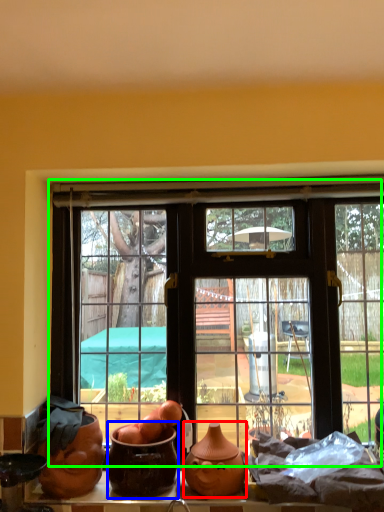
Question: Which object is positioned closest to pottery (highlighted by a red box)? Select from pottery (highlighted by a blue box) and window (highlighted by a green box).

Choices:
 (A) pottery
 (B) window

Answer: (A)